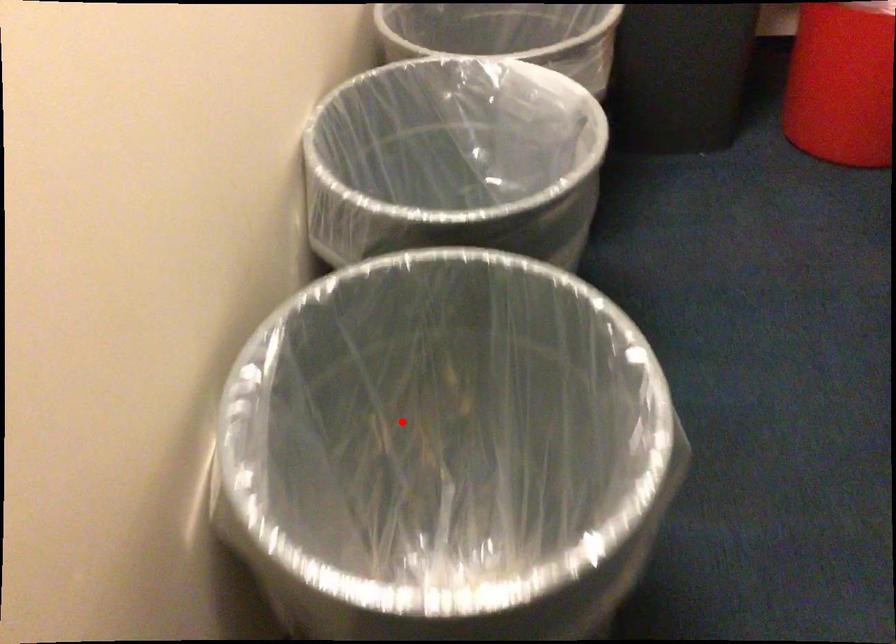
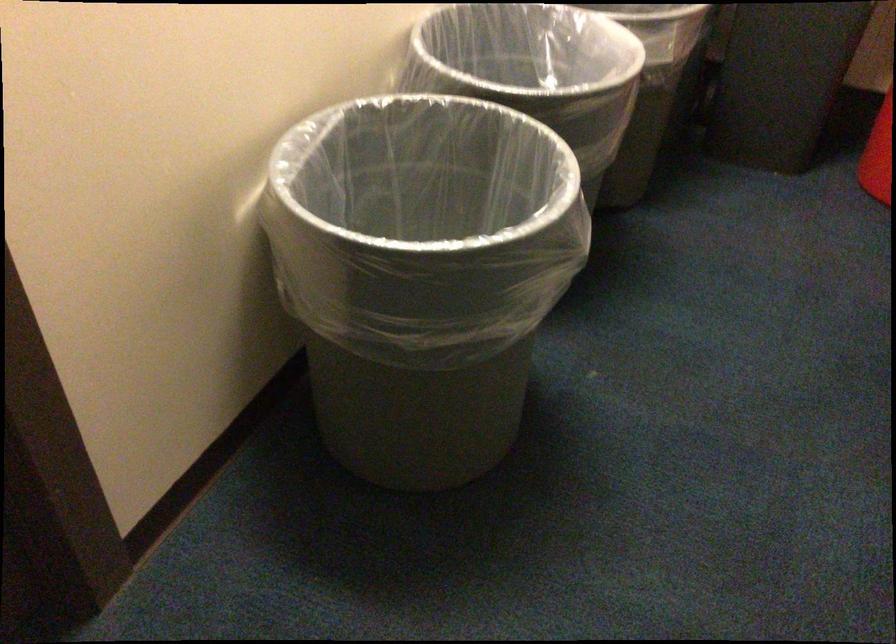
Question: I am providing you with two images of the same scene from different viewpoints. In image1, a red point is highlighted. Considering the same 3D point in image2, which of the following is correct?

Choices:
 (A) It is closer
 (B) It is farther

Answer: (B)